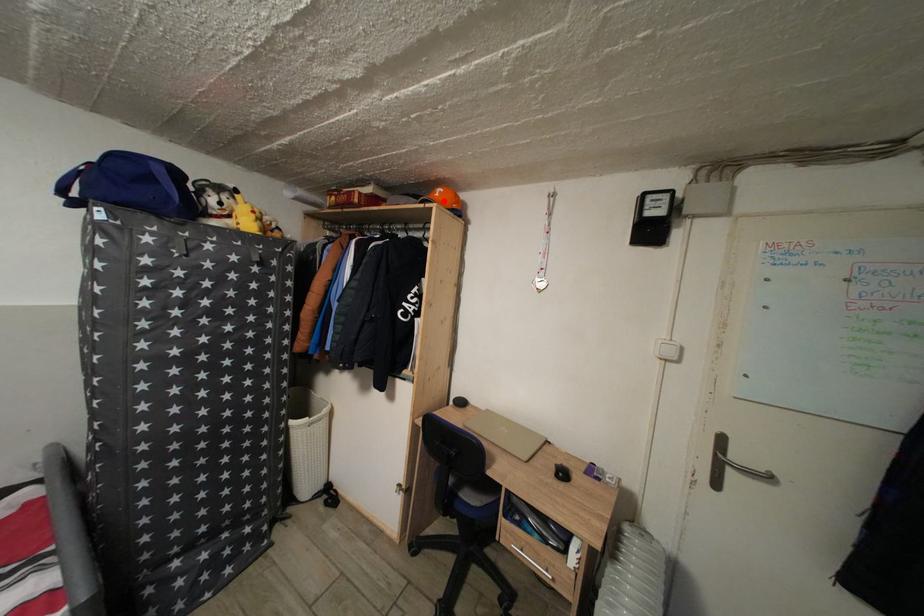
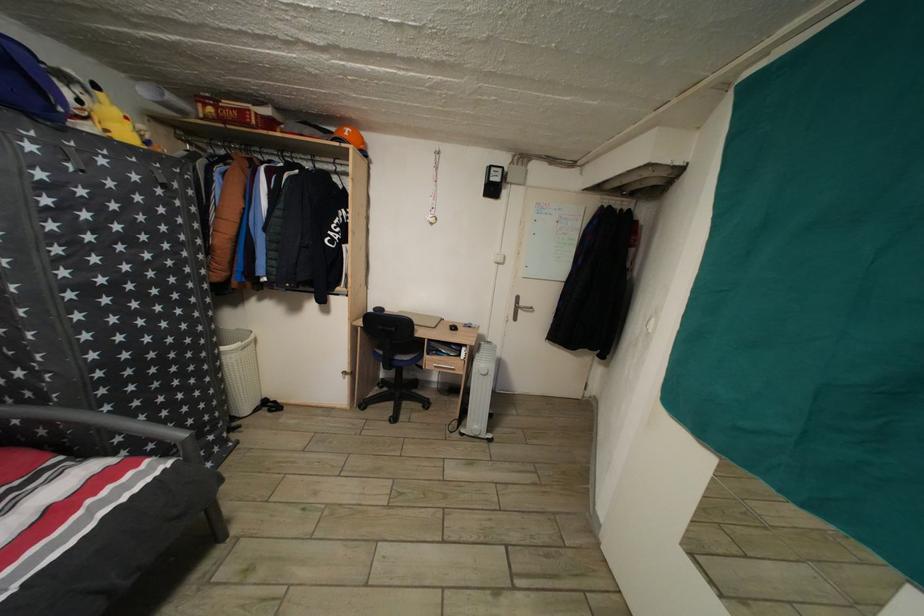
Locate, in the second image, the point that corresponds to the highlighted location in the first image.

(354, 140)